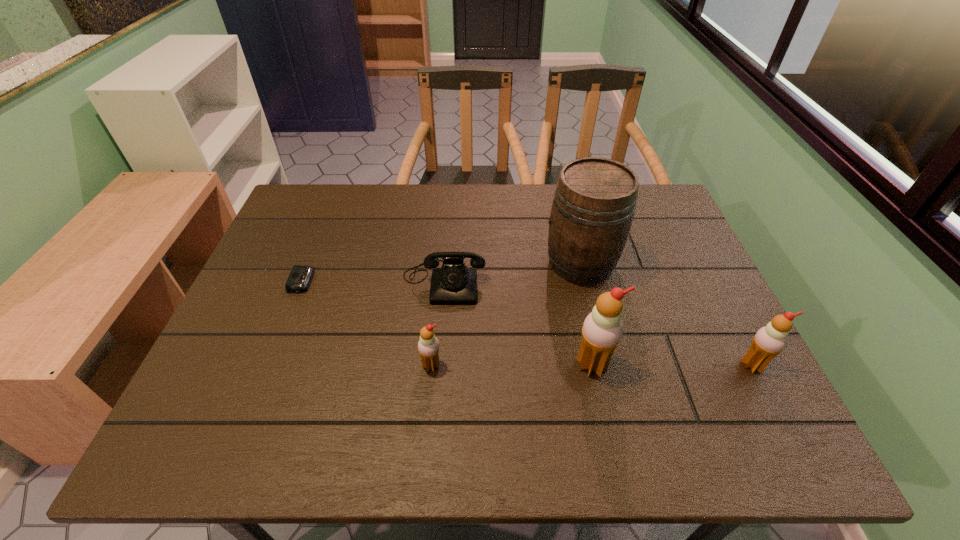
I want to click on vacant space located at the front with a straw on the rightmost icecream, so click(x=773, y=405).

Locate an element on the screen. The image size is (960, 540). vacant point located 0.060m on the front face of the telephone is located at coordinates (441, 324).

At what (x,y) coordinates should I click in order to perform the action: click on vacant space situated on the side of the cider near the bung hole. Please return your answer as a coordinate pair (x, y). Looking at the image, I should click on (507, 263).

What are the coordinates of `free point located on the side of the cider near the bung hole` in the screenshot? It's located at (405, 263).

Locate an element on the screen. The width and height of the screenshot is (960, 540). vacant space located 0.050m on the side of the cider near the bung hole is located at coordinates (525, 263).

Locate an element on the screen. The height and width of the screenshot is (540, 960). vacant area situated on the display of the alarm clock is located at coordinates (452, 281).

At what (x,y) coordinates should I click in order to perform the action: click on object that is positioned at the left edge. Please return your answer as a coordinate pair (x, y). Looking at the image, I should click on (300, 277).

The height and width of the screenshot is (540, 960). In order to click on object present at the right edge in this screenshot , I will do `click(769, 341)`.

What are the coordinates of `object situated at the near right corner` in the screenshot? It's located at (769, 341).

This screenshot has width=960, height=540. In order to click on free space at the far edge in this screenshot , I will do `click(394, 208)`.